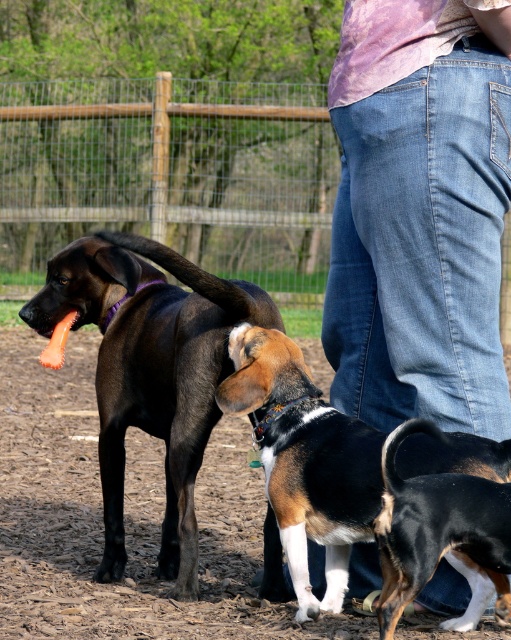
Question: Estimate the real-world distances between objects in this image. Which object is closer to the denim jeans at lower right?

Choices:
 (A) brown and white fur at lower right
 (B) tri-color fur beagle at lower center
 (C) wooden fence at upper center
 (D) shiny black dog at center

Answer: (B)

Question: Which point is closer to the camera taking this photo?

Choices:
 (A) (423, 536)
 (B) (291, 456)
 (C) (218, 90)

Answer: (A)

Question: Is shiny black dog at center bigger than brown and white fur at lower right?

Choices:
 (A) no
 (B) yes

Answer: (B)

Question: Which point appears farthest from the camera in this image?

Choices:
 (A) (301, 401)
 (B) (457, 330)

Answer: (A)

Question: Is denim jeans at lower right thinner than brown and white fur at lower right?

Choices:
 (A) yes
 (B) no

Answer: (B)

Question: Is shiny black dog at center to the right of brown and white fur at lower right from the viewer's perspective?

Choices:
 (A) no
 (B) yes

Answer: (A)